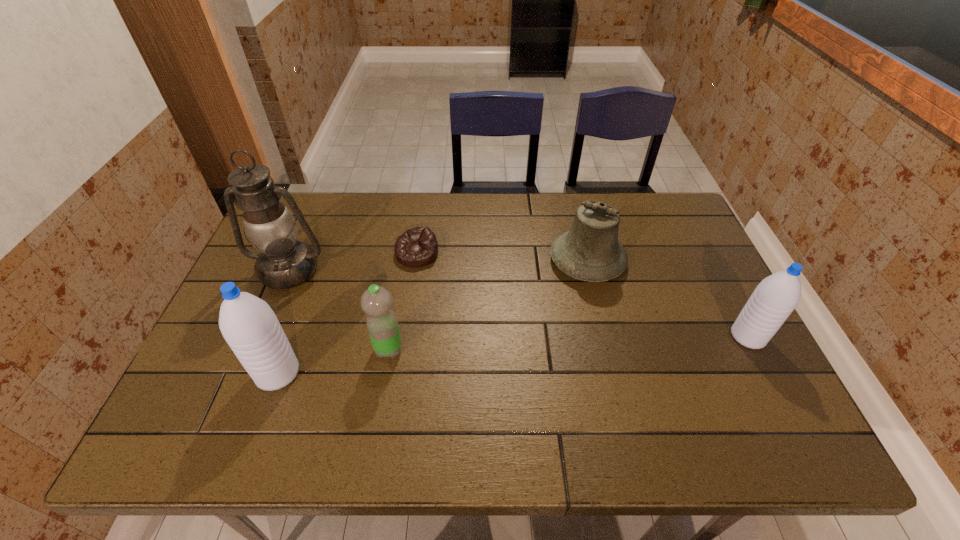
Locate an element on the screen. vacant space located 0.110m on the back of the bell is located at coordinates (576, 215).

Locate an element on the screen. vacant position located on the right of the tallest object is located at coordinates click(x=428, y=269).

Where is `blank space located 0.240m on the right of the second water bottle from right to left`? blank space located 0.240m on the right of the second water bottle from right to left is located at coordinates (500, 349).

This screenshot has width=960, height=540. I want to click on object that is at the far edge, so click(x=590, y=251).

The image size is (960, 540). I want to click on object that is at the near edge, so click(x=248, y=324).

Find the location of a particular element. This screenshot has height=540, width=960. water bottle that is at the left edge is located at coordinates (248, 324).

This screenshot has height=540, width=960. I want to click on oil lamp located at the left edge, so click(x=284, y=262).

Where is `object that is at the right edge`? The height and width of the screenshot is (540, 960). object that is at the right edge is located at coordinates (776, 296).

This screenshot has width=960, height=540. In order to click on object that is at the near left corner in this screenshot , I will do `click(248, 324)`.

In the image, there is a desktop. Where is `vacant space at the far edge`? The width and height of the screenshot is (960, 540). vacant space at the far edge is located at coordinates (351, 195).